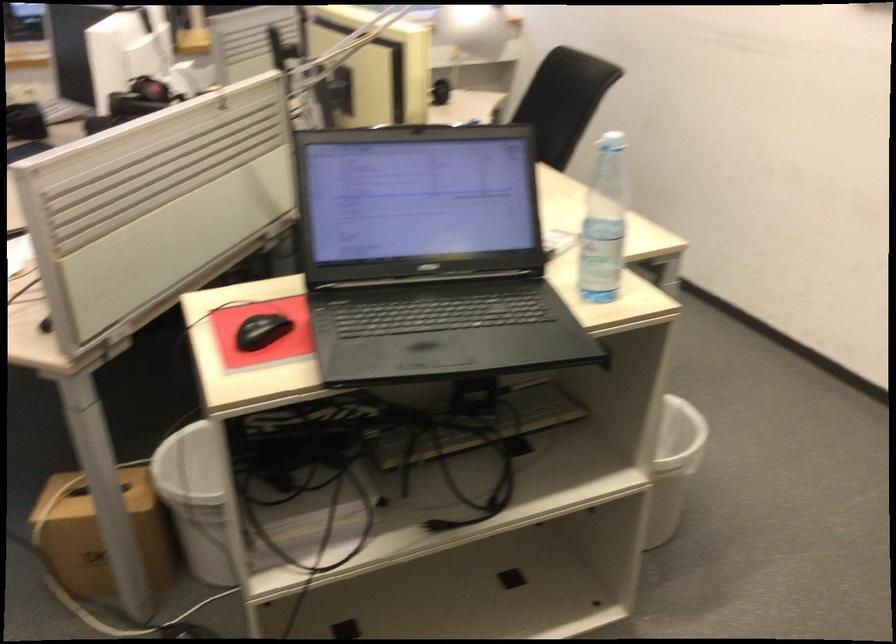
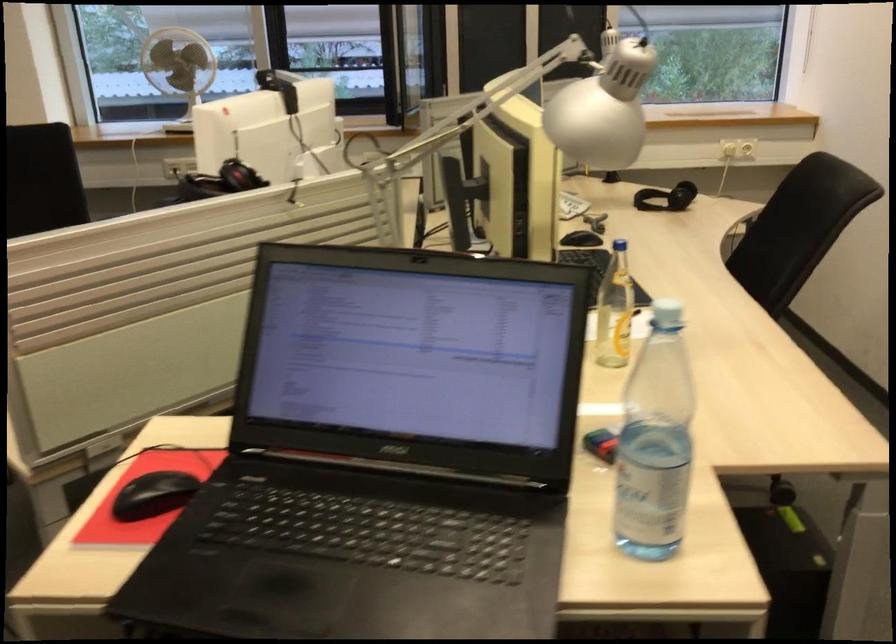
The point at (x=135, y=100) is marked in the first image. Where is the corresponding point in the second image?

(220, 182)